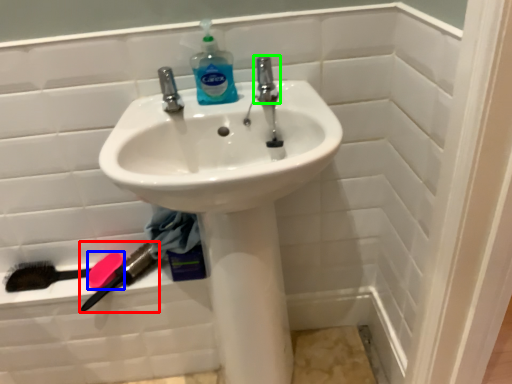
Question: Based on their relative distances, which object is nearer to brush (highlighted by a red box)? Choose from soap (highlighted by a blue box) and tap (highlighted by a green box).

Choices:
 (A) soap
 (B) tap

Answer: (A)